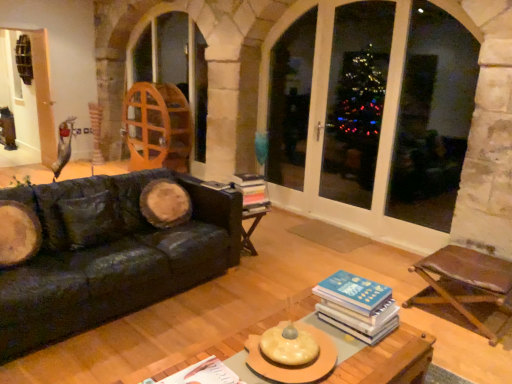
The height and width of the screenshot is (384, 512). I want to click on free space on the front side of blue hardcover book at center, acting as the second book starting from the front, so click(x=370, y=357).